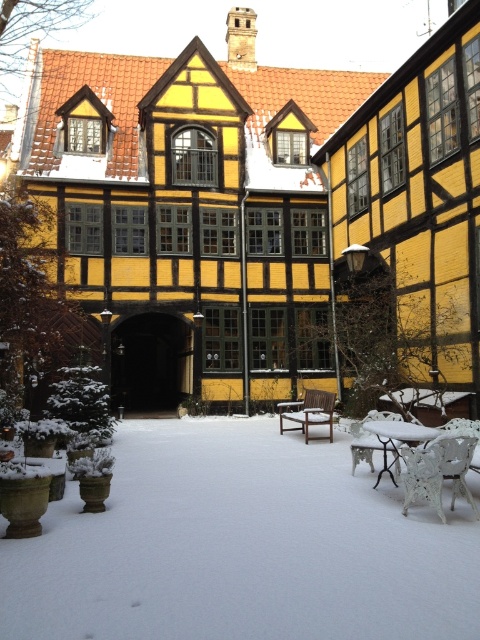
Question: Where is brown wooden chair at center located in relation to metallic silver chair at lower right in the image?

Choices:
 (A) below
 (B) above

Answer: (B)

Question: Which point is farther from the camera taking this photo?

Choices:
 (A) (289, 404)
 (B) (105, 602)
 (C) (352, 467)
 (D) (440, 490)

Answer: (A)

Question: Can you confirm if white powdery snow at lower left is thinner than metallic silver chair at lower right?

Choices:
 (A) no
 (B) yes

Answer: (A)

Question: Estimate the real-world distances between objects in this image. Which object is closer to the brown wooden chair at center?

Choices:
 (A) metallic silver chair at lower right
 (B) white powdery snow at lower left

Answer: (A)

Question: Which object appears closest to the camera in this image?

Choices:
 (A) white plastic chair at lower right
 (B) white powdery snow at lower left

Answer: (B)

Question: Is white plastic chair at lower right to the right of brown wooden chair at center from the viewer's perspective?

Choices:
 (A) yes
 (B) no

Answer: (A)